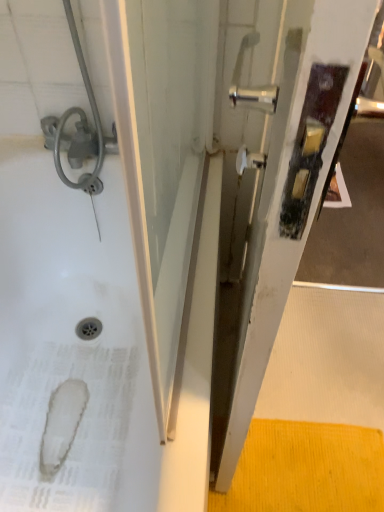
Identify the location of white glossy bathtub at upper left. This screenshot has height=512, width=384. (71, 339).

Measure the distance between white glossy bathtub at upper left and camera.

white glossy bathtub at upper left is 34.97 inches away from camera.

The width and height of the screenshot is (384, 512). What do you see at coordinates (71, 339) in the screenshot?
I see `white glossy bathtub at upper left` at bounding box center [71, 339].

Locate an element on the screen. This screenshot has width=384, height=512. white glossy bathtub at upper left is located at coordinates (71, 339).